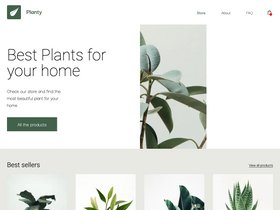
This screenshot has width=280, height=210. Find the location of `basket with red dot`. basket with red dot is located at coordinates (269, 12).